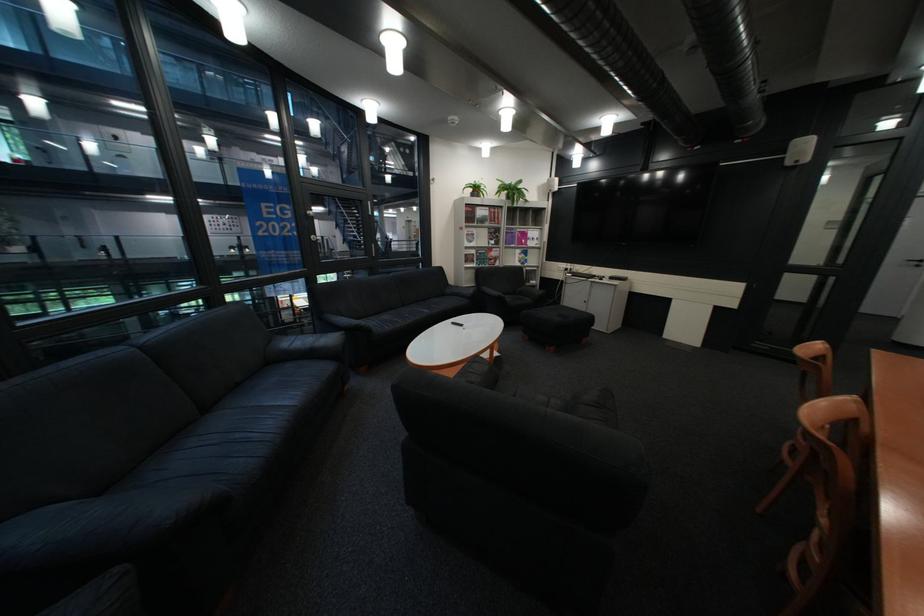
Locate an element on the screen. Image resolution: width=924 pixels, height=616 pixels. black sofa sitting surface is located at coordinates (434, 309).